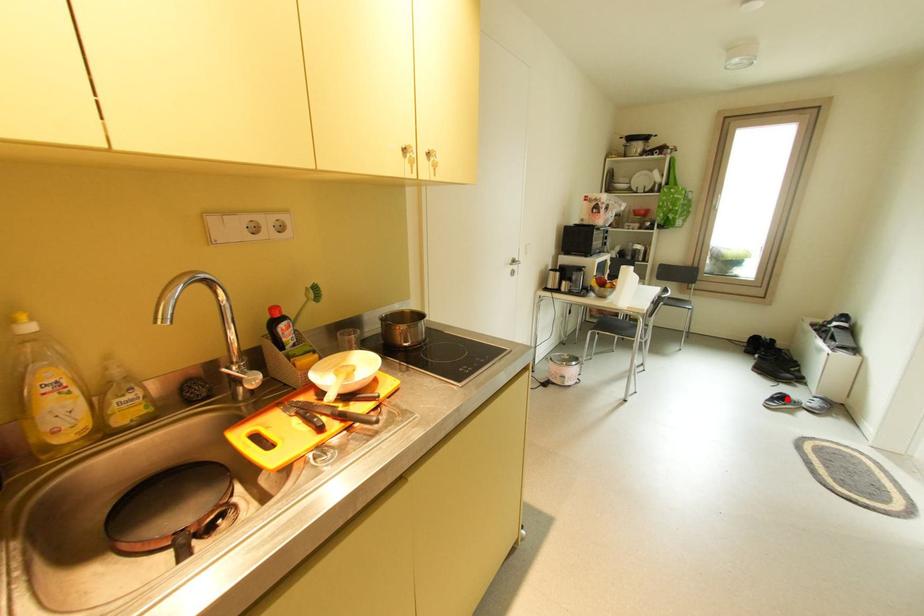
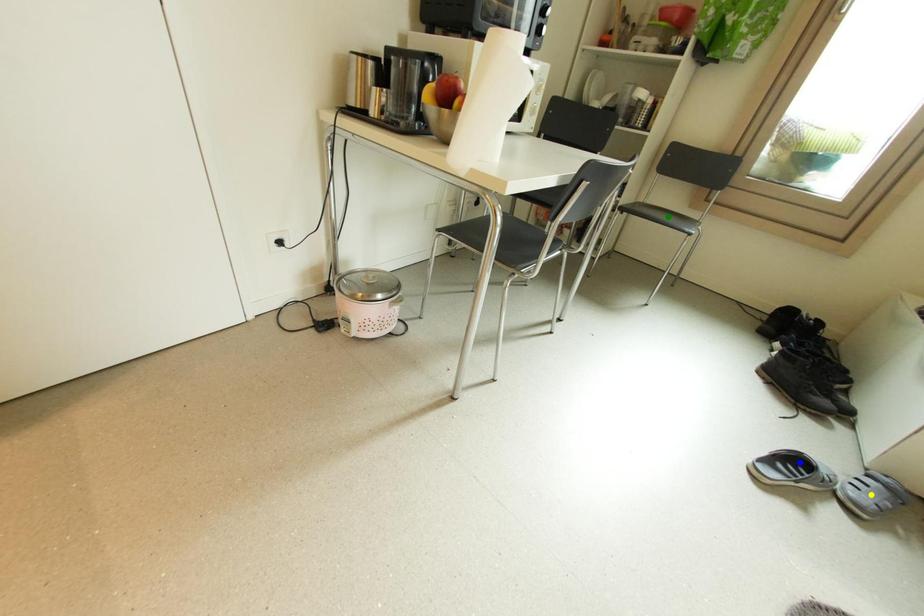
Question: I am providing you with two images of the same scene from different viewpoints. A red point is marked on the first image. You are given multiple points on the second image. Which point in image 2 is actually the same real-world point as the red point in image 1?

Choices:
 (A) blue point
 (B) yellow point
 (C) green point

Answer: (A)